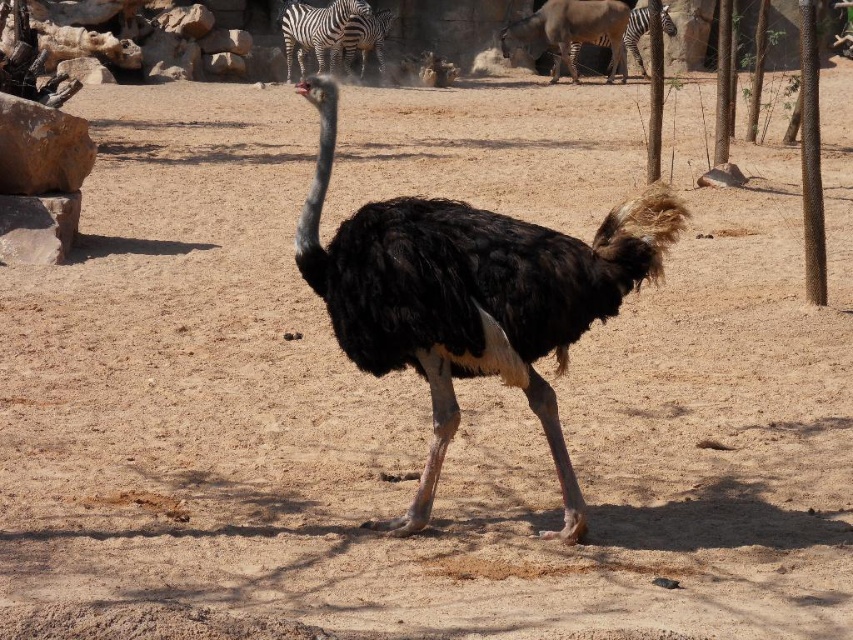
Question: Estimate the real-world distances between objects in this image. Which object is closer to the brown rough bark tree at right?

Choices:
 (A) brown textured pole at right
 (B) black and white striped zebra at upper center
 (C) black feathered ostrich at center
 (D) black striped zebra at upper center

Answer: (D)

Question: Considering the real-world distances, which object is closest to the brown rough bark tree at right?

Choices:
 (A) black striped zebra at upper center
 (B) black and white striped zebra at upper center
 (C) black feathered ostrich at center

Answer: (A)

Question: Among these objects, which one is nearest to the camera?

Choices:
 (A) black feathered ostrich at center
 (B) black and white striped zebra at upper center

Answer: (A)

Question: Is brown textured pole at right thinner than black striped zebra at upper center?

Choices:
 (A) no
 (B) yes

Answer: (B)

Question: From the image, what is the correct spatial relationship of brown rough bark tree at right in relation to black striped zebra at upper center?

Choices:
 (A) left
 (B) right

Answer: (B)

Question: Is brown textured pole at right to the right of brown rough bark tree at right from the viewer's perspective?

Choices:
 (A) yes
 (B) no

Answer: (B)